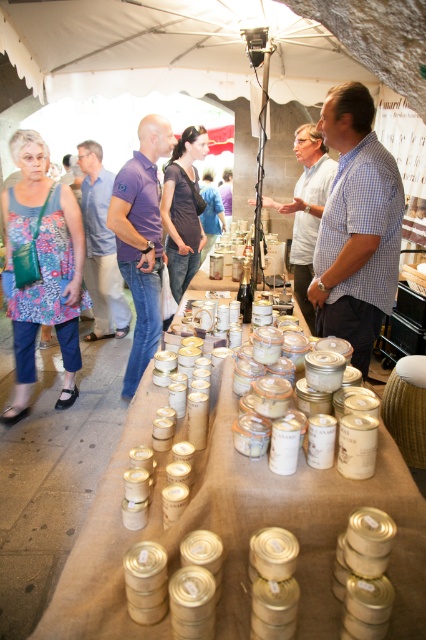
You are a photographer standing at the back of the market. You want to take a photo that includes both the floral fabric dress at left and the purple cotton shirt at center. Which one will appear larger in your photo?

The floral fabric dress at left will appear larger in the photo because it is closer to the viewer than the purple cotton shirt at center.

You are standing at the market table and want to place a new item between the two points marked as point (360, 170) and point (196, 236). Since you need to know which direction to move forward, can you tell me which point is closer to you?

Point (360, 170) is in front of point (196, 236), so it is closer to you. Therefore, you should move towards point (360, 170) to place the item between them.

You are a vendor at the market and need to decide which clothing item to place on the table. The purple cotton polo shirt at center and the dark brown leather jacket at center are both available. Which item requires more space due to its size?

The purple cotton polo shirt at center requires more space because it is larger in size than the dark brown leather jacket at center.